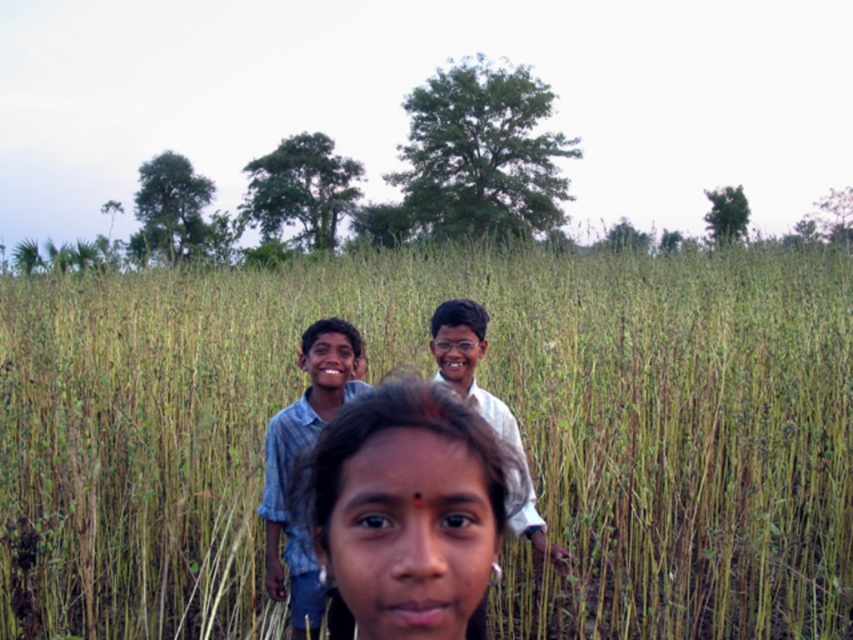
Is point (602, 525) positioned in front of point (283, 420)?

That is False.

Can you confirm if green grass at center is taller than blue denim shirt at center?

Indeed, green grass at center has a greater height compared to blue denim shirt at center.

Between point (148, 424) and point (334, 628), which one is positioned in front?

Positioned in front is point (334, 628).

This screenshot has width=853, height=640. Find the location of `green grass at center`. green grass at center is located at coordinates (430, 376).

Is green grass at center smaller than white glossy shirt at center?

Actually, green grass at center might be larger than white glossy shirt at center.

Can you confirm if green grass at center is positioned to the left of white glossy shirt at center?

Indeed, green grass at center is positioned on the left side of white glossy shirt at center.

Where is `green grass at center`? green grass at center is located at coordinates (430, 376).

Image resolution: width=853 pixels, height=640 pixels. I want to click on green grass at center, so click(430, 376).

Does blue denim shirt at center have a lesser width compared to white glossy shirt at center?

No.

Between blue denim shirt at center and white glossy shirt at center, which one appears on the left side from the viewer's perspective?

Positioned to the left is blue denim shirt at center.

This screenshot has height=640, width=853. What are the coordinates of `blue denim shirt at center` in the screenshot? It's located at (300, 474).